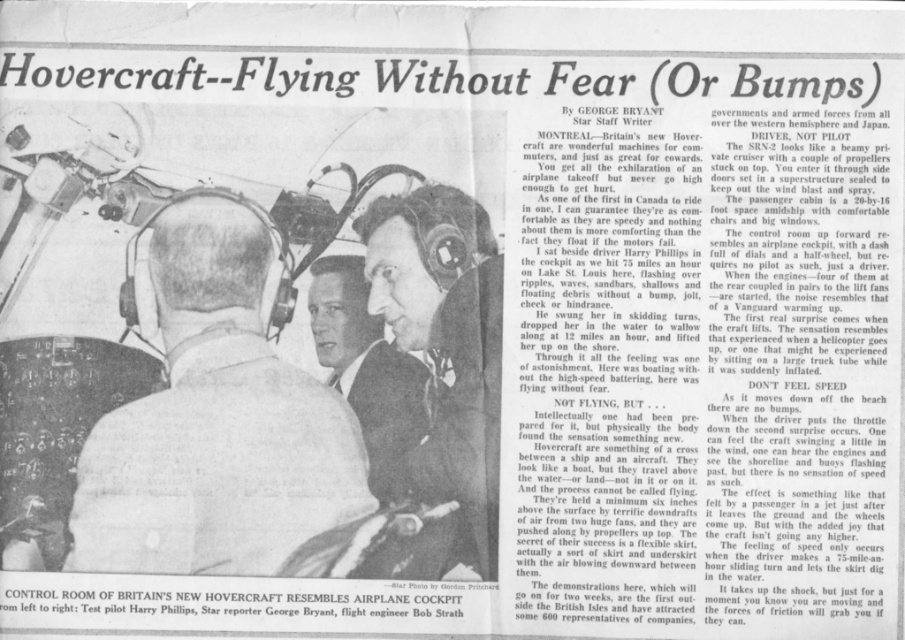
You are a photographer who wants to capture a clear photo of both point (424, 220) and point (391, 422) in the control room. Since you can only focus on one point at a time, which point should you focus on to ensure both points are in focus?

You should focus on point (391, 422) because it is closer to the camera than point (424, 220). By focusing on the closer point, the depth of field will likely include the farther point as well, ensuring both are in focus.

You are a passenger on the hovercraft and want to grab the closest item to you in the control room. Which item should you choose between the matte black helmet at center and the light brown suit jacket at center?

The matte black helmet at center is closer to the viewer than the light brown suit jacket at center, so you should choose the matte black helmet at center.

You are a passenger on the hovercraft and need to locate your belongings. You remember seeing a white leather jacket at center and a matte black helmet at center. Based on the scene, which item is closer to you?

The white leather jacket at center is in front of the matte black helmet at center, so it is closer to you.